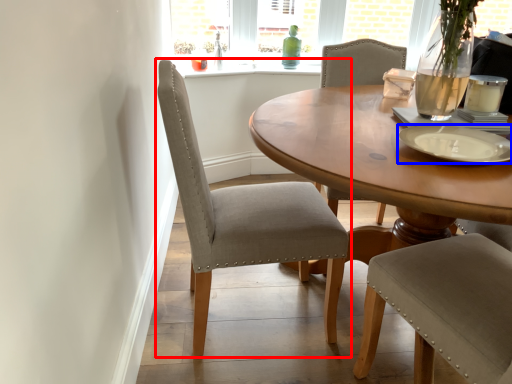
Question: Which object appears farthest to the camera in this image, chair (highlighted by a red box) or platter (highlighted by a blue box)?

Choices:
 (A) chair
 (B) platter

Answer: (A)